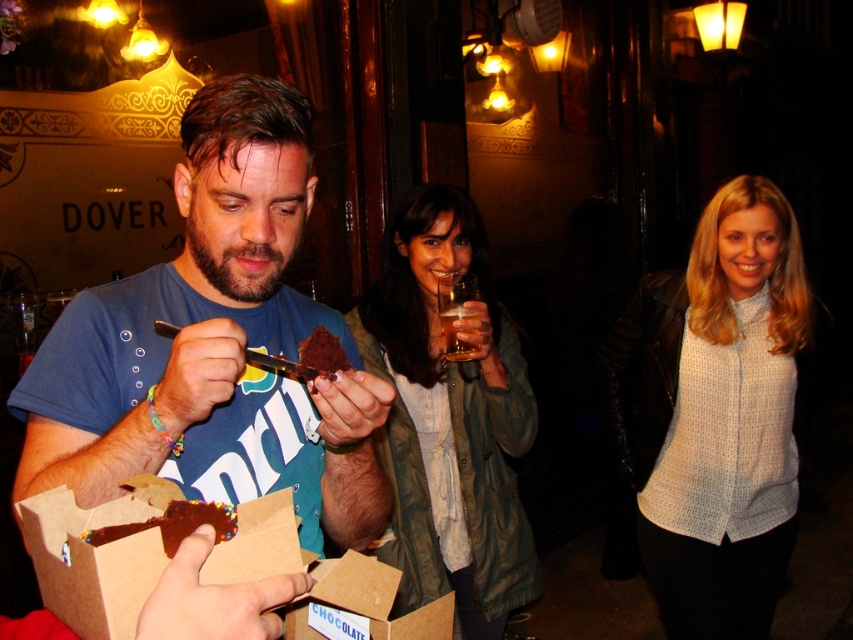
Question: Is brown cardboard box at center smaller than chocolate-coated cookie at center?

Choices:
 (A) no
 (B) yes

Answer: (A)

Question: Which of the following is the closest to the observer?

Choices:
 (A) chocolate-coated cookie at center
 (B) translucent glass at center
 (C) chocolate cake at center
 (D) matte blue t-shirt at center

Answer: (A)

Question: Which of the following is the closest to the observer?

Choices:
 (A) chocolate-coated cookie at center
 (B) green textured jacket at center
 (C) matte blue t-shirt at center

Answer: (A)

Question: Is green textured jacket at center thinner than translucent glass at center?

Choices:
 (A) yes
 (B) no

Answer: (B)

Question: Which of the following is the closest to the observer?

Choices:
 (A) (184, 176)
 (B) (465, 248)

Answer: (A)

Question: Does matte blue t-shirt at center have a larger size compared to chocolate cake at center?

Choices:
 (A) no
 (B) yes

Answer: (B)